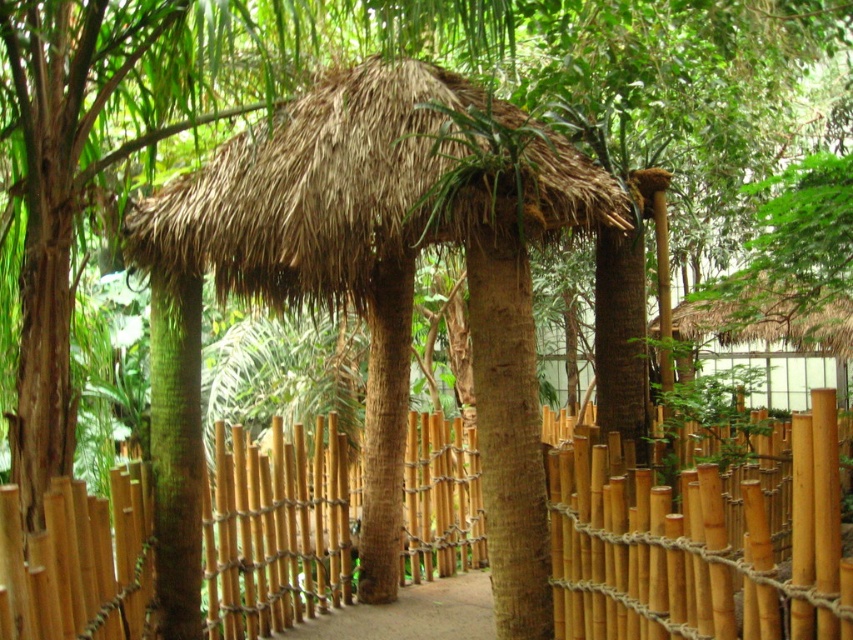
Question: Can you confirm if bamboo fence at center is positioned below thatched straw hut at upper right?

Choices:
 (A) no
 (B) yes

Answer: (B)

Question: Based on their relative distances, which object is nearer to the thatched straw hut at upper right?

Choices:
 (A) bamboo fence at center
 (B) brown dirt path at center

Answer: (B)

Question: Which is farther from the brown dirt path at center?

Choices:
 (A) thatched straw hut at upper right
 (B) bamboo fence at center

Answer: (A)

Question: Does thatched straw hut at upper right appear on the right side of brown dirt path at center?

Choices:
 (A) no
 (B) yes

Answer: (B)

Question: Which object is the farthest from the thatched straw hut at upper right?

Choices:
 (A) bamboo fence at center
 (B) brown dirt path at center

Answer: (A)

Question: Does bamboo fence at center have a larger size compared to brown dirt path at center?

Choices:
 (A) no
 (B) yes

Answer: (B)